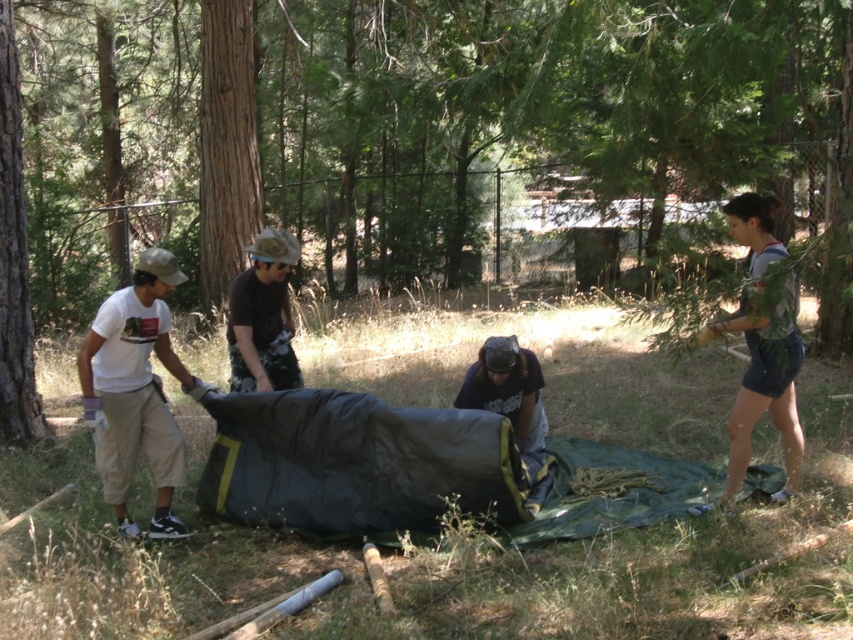
Does gray cotton shorts at right appear on the right side of dark blue fabric at center?

Yes, gray cotton shorts at right is to the right of dark blue fabric at center.

Describe the element at coordinates (761, 352) in the screenshot. I see `gray cotton shorts at right` at that location.

The image size is (853, 640). In order to click on gray cotton shorts at right in this screenshot , I will do `click(761, 352)`.

Which of these two, white cotton t-shirt at left or brown rough tree trunk at center-left, stands shorter?

With less height is white cotton t-shirt at left.

Does point (105, 442) come farther from viewer compared to point (229, 83)?

No, it is not.

The height and width of the screenshot is (640, 853). Find the location of `white cotton t-shirt at left`. white cotton t-shirt at left is located at coordinates (135, 390).

Is gray cotton shorts at right to the right of camouflage fabric shirt at center from the viewer's perspective?

Indeed, gray cotton shorts at right is positioned on the right side of camouflage fabric shirt at center.

Find the location of `gray cotton shorts at right`. gray cotton shorts at right is located at coordinates (761, 352).